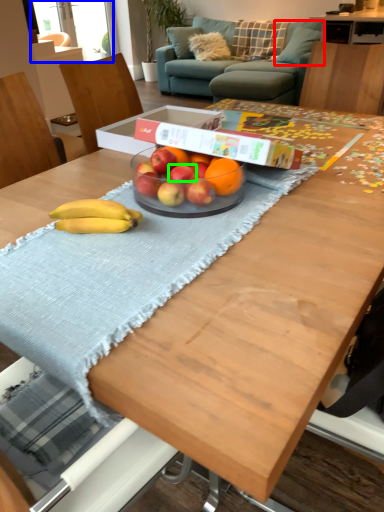
Question: Based on their relative distances, which object is farther from pillow (highlighted by a red box)? Choose from window screen (highlighted by a blue box) and apple (highlighted by a green box).

Choices:
 (A) window screen
 (B) apple

Answer: (B)